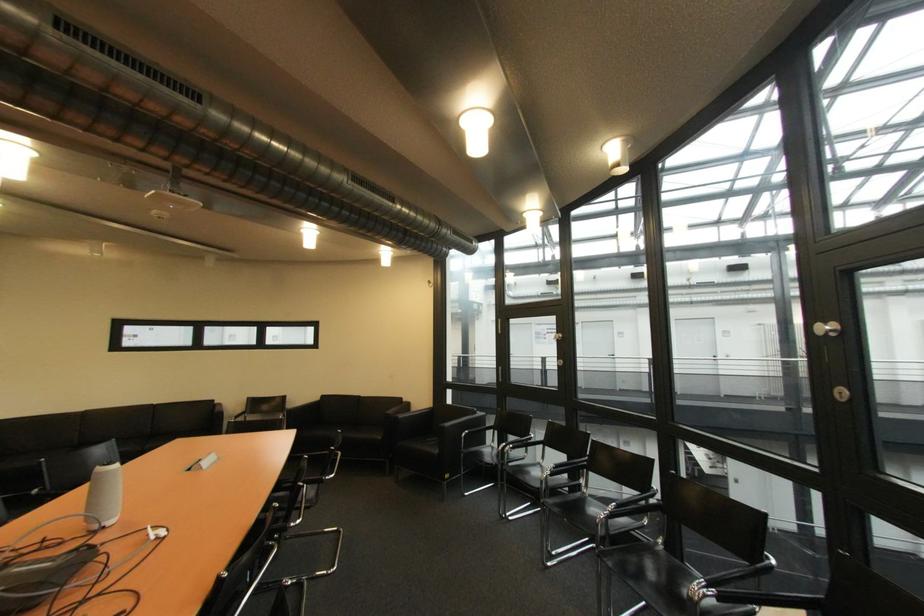
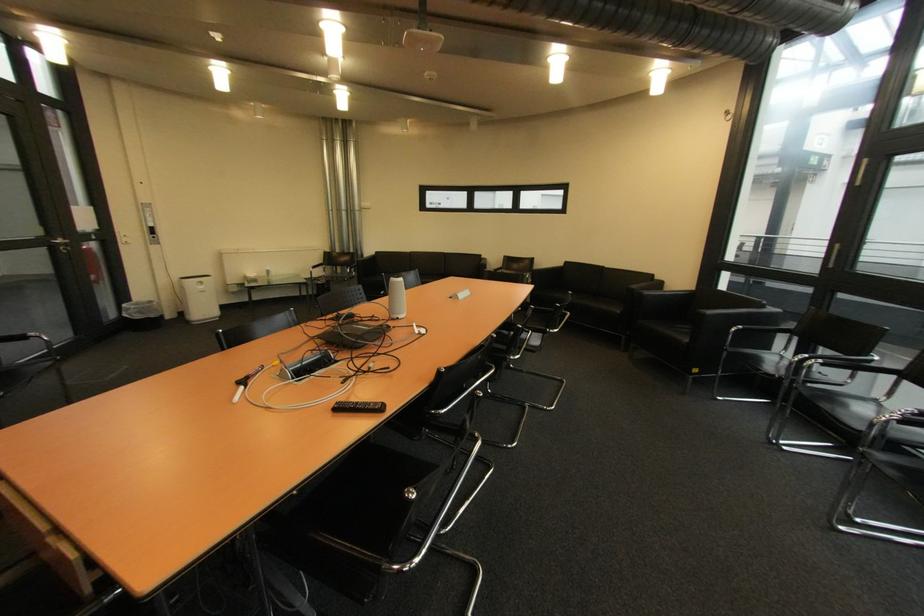
The point at (519, 447) is marked in the first image. Where is the corresponding point in the second image?

(829, 362)